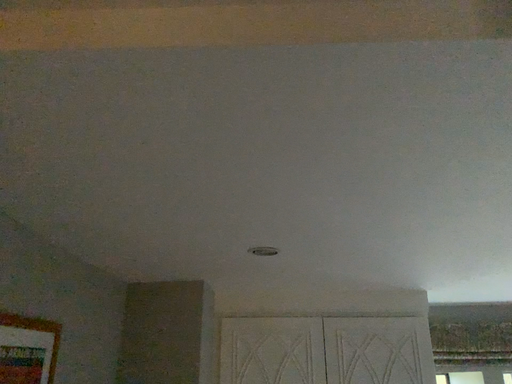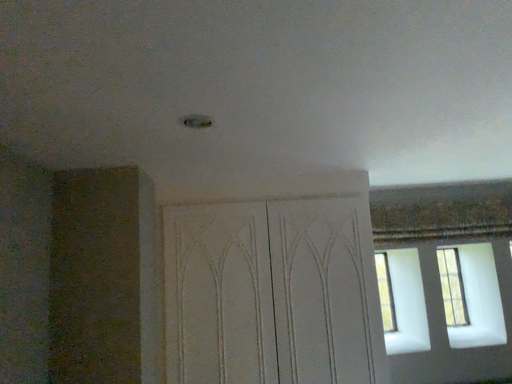
Question: Which way did the camera rotate in the video?

Choices:
 (A) rotated left
 (B) rotated right

Answer: (B)